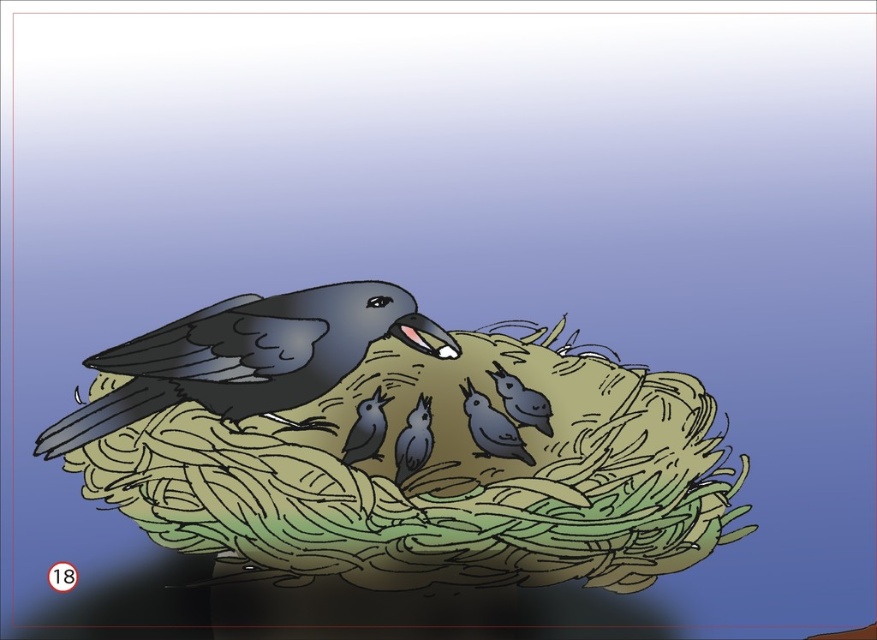
You are a birdwatcher trying to observe the birds in the image. The adult bird is a matte black bird at center, and the chicks are matte gray birds at center. How far apart are the adult bird and the chicks?

The matte gray birds at center and matte black bird at center are 8.54 centimeters apart.

You are observing a bird feeding its chicks in a nest. You see a matte gray bird at center and smooth gray birds at center. Which of these is the parent bird?

The matte gray bird at center is the parent bird because it is positioned below the smooth gray birds at center, indicating it is feeding them from above.

In the image of a bird feeding its chicks, there is a matte gray bird at center and smooth gray birds at center. Which of these birds is taller?

The matte gray bird at center is taller than the smooth gray birds at center.